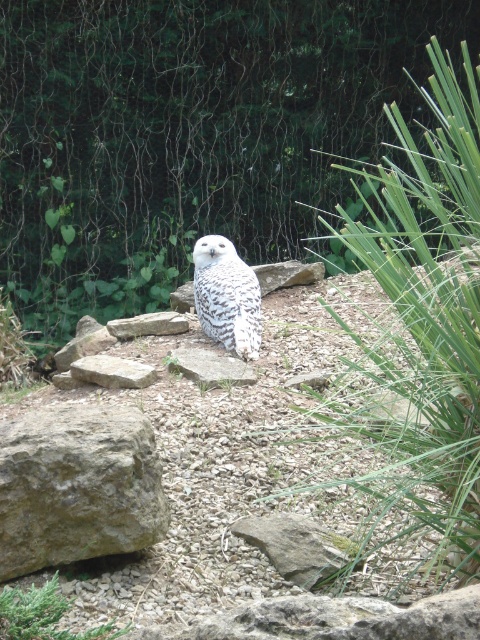
You are an ornithologist observing a snowy owl in its natural habitat. You notice a point marked at coordinates (227,296). Based on the scene description, which object does this point correspond to?

The point at coordinates (227,296) corresponds to the white speckled owl at center.

You are an ornithologist studying the spatial positioning of owls in their natural habitats. Given the coordinates provided, can you determine the exact location of the white speckled owl at center in the image?

The white speckled owl at center is located at coordinates point (227, 296).